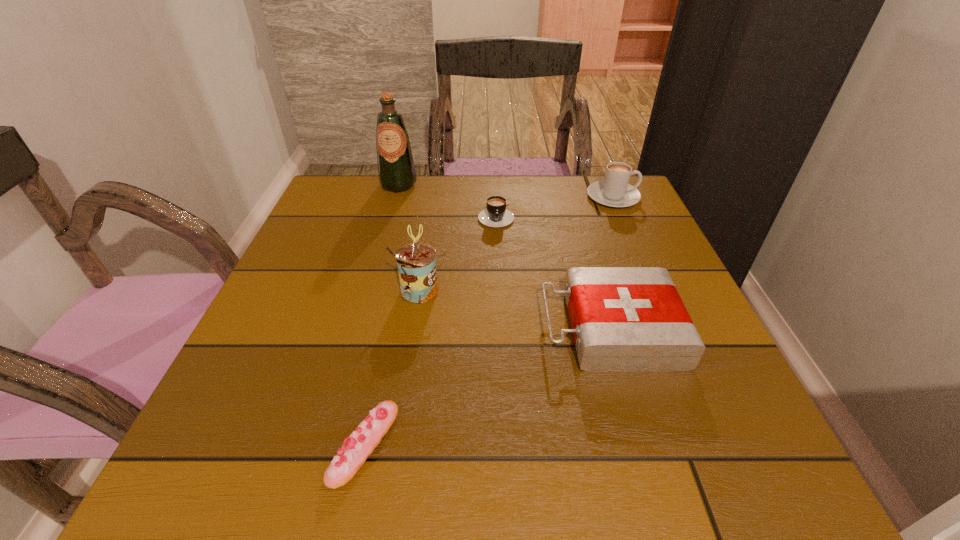
This screenshot has width=960, height=540. I want to click on vacant position in the image that satisfies the following two spatial constraints: 1. to the right of the taller cappuccino; 2. with the handle on the side of the second shortest object, so click(621, 215).